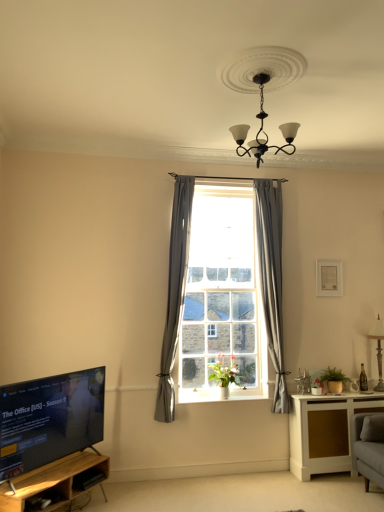
Question: Can you confirm if gray fabric curtain at center, which ranks as the second curtain in left-to-right order, is positioned to the right of white matte picture frame at upper right?

Choices:
 (A) no
 (B) yes

Answer: (A)

Question: Does gray fabric curtain at center, the 1th curtain positioned from the right, have a greater width compared to white matte picture frame at upper right?

Choices:
 (A) no
 (B) yes

Answer: (B)

Question: Is gray fabric curtain at center, the 1th curtain positioned from the right, outside white matte picture frame at upper right?

Choices:
 (A) yes
 (B) no

Answer: (A)

Question: Does gray fabric curtain at center, the 1th curtain positioned from the right, turn towards white matte picture frame at upper right?

Choices:
 (A) yes
 (B) no

Answer: (B)

Question: From a real-world perspective, is gray fabric curtain at center, which ranks as the second curtain in left-to-right order, on white matte picture frame at upper right?

Choices:
 (A) yes
 (B) no

Answer: (B)

Question: Is black glossy tv at lower left situated inside matte black lamp at right or outside?

Choices:
 (A) inside
 (B) outside

Answer: (B)

Question: Considering the positions of black glossy tv at lower left and matte black lamp at right in the image, is black glossy tv at lower left wider or thinner than matte black lamp at right?

Choices:
 (A) thin
 (B) wide

Answer: (B)

Question: From their relative heights in the image, would you say black glossy tv at lower left is taller or shorter than matte black lamp at right?

Choices:
 (A) short
 (B) tall

Answer: (A)

Question: From a real-world perspective, relative to matte black lamp at right, is black glossy tv at lower left vertically above or below?

Choices:
 (A) above
 (B) below

Answer: (B)

Question: Is point (216, 377) positioned closer to the camera than point (74, 417)?

Choices:
 (A) farther
 (B) closer

Answer: (A)

Question: Choose the correct answer: Is green matte vase at window, positioned as the 2th plant in right-to-left order, inside black glossy tv at lower left or outside it?

Choices:
 (A) inside
 (B) outside

Answer: (B)

Question: From the image's perspective, is green matte vase at window, positioned as the 2th plant in right-to-left order, above or below black glossy tv at lower left?

Choices:
 (A) below
 (B) above

Answer: (B)

Question: Is green matte vase at window, positioned as the 2th plant in right-to-left order, wider or thinner than black glossy tv at lower left?

Choices:
 (A) wide
 (B) thin

Answer: (A)

Question: From the image's perspective, relative to white matte picture frame at upper right, is black glossy tv at lower left above or below?

Choices:
 (A) above
 (B) below

Answer: (B)

Question: From a real-world perspective, is black glossy tv at lower left above or below white matte picture frame at upper right?

Choices:
 (A) above
 (B) below

Answer: (B)